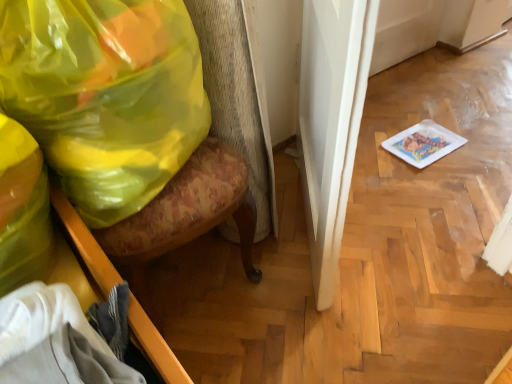
Question: From a real-world perspective, is translucent yellow plastic bag at left physically below floral fabric swivel chair at left?

Choices:
 (A) no
 (B) yes

Answer: (A)

Question: Is translucent yellow plastic bag at left not close to floral fabric swivel chair at left?

Choices:
 (A) yes
 (B) no

Answer: (B)

Question: Considering the relative sizes of translucent yellow plastic bag at left and floral fabric swivel chair at left in the image provided, is translucent yellow plastic bag at left bigger than floral fabric swivel chair at left?

Choices:
 (A) yes
 (B) no

Answer: (B)

Question: Does translucent yellow plastic bag at left have a lesser height compared to floral fabric swivel chair at left?

Choices:
 (A) no
 (B) yes

Answer: (B)

Question: Can you confirm if translucent yellow plastic bag at left is smaller than floral fabric swivel chair at left?

Choices:
 (A) no
 (B) yes

Answer: (B)

Question: From the image's perspective, would you say translucent yellow plastic bag at left is positioned over floral fabric swivel chair at left?

Choices:
 (A) no
 (B) yes

Answer: (B)

Question: Is wooden drawer at lower left shorter than translucent yellow plastic bag at left?

Choices:
 (A) yes
 (B) no

Answer: (A)

Question: Could you tell me if wooden drawer at lower left is facing translucent yellow plastic bag at left?

Choices:
 (A) yes
 (B) no

Answer: (B)

Question: Does wooden drawer at lower left lie behind translucent yellow plastic bag at left?

Choices:
 (A) no
 (B) yes

Answer: (A)

Question: Would you say wooden drawer at lower left is a long distance from translucent yellow plastic bag at left?

Choices:
 (A) no
 (B) yes

Answer: (A)

Question: Does wooden drawer at lower left have a larger size compared to translucent yellow plastic bag at left?

Choices:
 (A) yes
 (B) no

Answer: (B)

Question: From a real-world perspective, is wooden drawer at lower left below translucent yellow plastic bag at left?

Choices:
 (A) no
 (B) yes

Answer: (B)

Question: From a real-world perspective, is floral fabric swivel chair at left located higher than translucent yellow plastic bag at left?

Choices:
 (A) no
 (B) yes

Answer: (A)